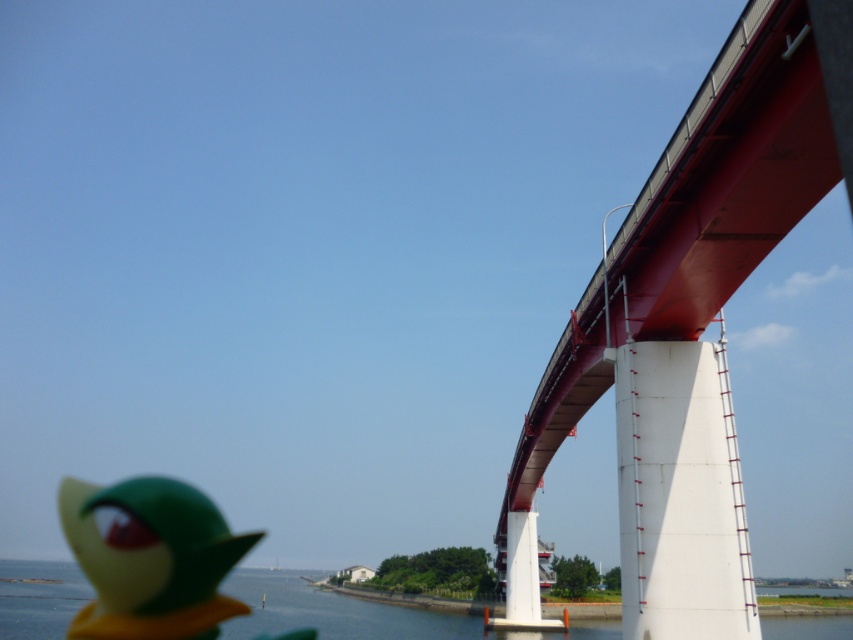
Question: Based on their relative distances, which object is nearer to the blue water at lower left?

Choices:
 (A) matte green rubber duck at lower left
 (B) red painted steel bridge at right

Answer: (A)

Question: Does red painted steel bridge at right appear on the right side of blue water at lower left?

Choices:
 (A) yes
 (B) no

Answer: (A)

Question: Where is red painted steel bridge at right located in relation to matte green rubber duck at lower left in the image?

Choices:
 (A) right
 (B) left

Answer: (A)

Question: Which object is the farthest from the red painted steel bridge at right?

Choices:
 (A) blue water at lower left
 (B) matte green rubber duck at lower left

Answer: (B)

Question: Which point is farther to the camera?

Choices:
 (A) blue water at lower left
 (B) matte green rubber duck at lower left
 (C) red painted steel bridge at right

Answer: (B)

Question: Can you confirm if matte green rubber duck at lower left is thinner than blue water at lower left?

Choices:
 (A) no
 (B) yes

Answer: (B)